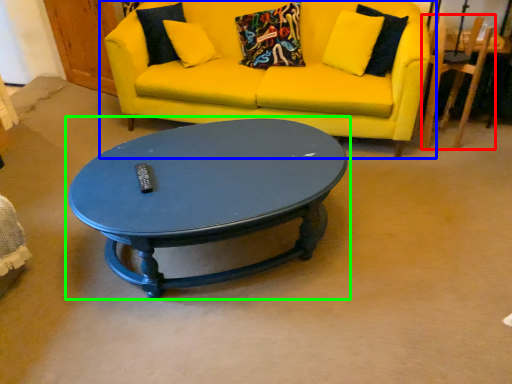
Question: Based on their relative distances, which object is farther from armchair (highlighted by a red box)? Choose from studio couch (highlighted by a blue box) and coffee table (highlighted by a green box).

Choices:
 (A) studio couch
 (B) coffee table

Answer: (B)